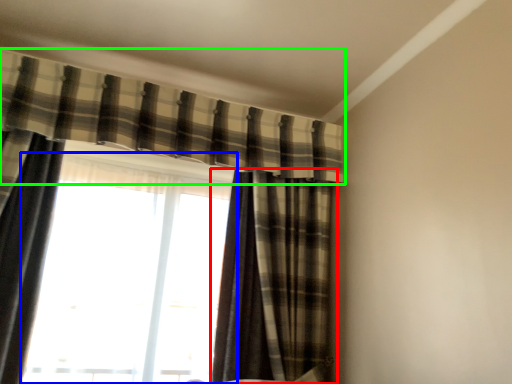
Question: Based on their relative distances, which object is nearer to curtain (highlighted by a red box)? Choose from window (highlighted by a blue box) and curtain (highlighted by a green box).

Choices:
 (A) window
 (B) curtain

Answer: (A)